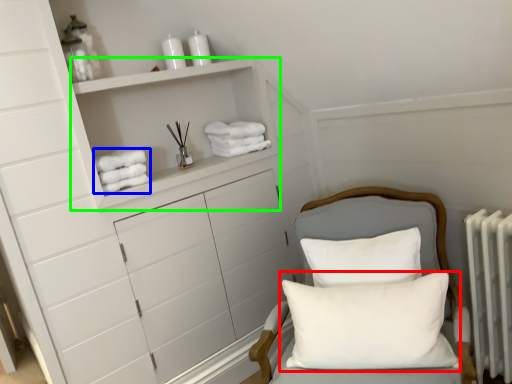
Question: Which object is the farthest from pillow (highlighted by a red box)? Choose among these: bath towel (highlighted by a blue box) or cabinet (highlighted by a green box).

Choices:
 (A) bath towel
 (B) cabinet

Answer: (A)